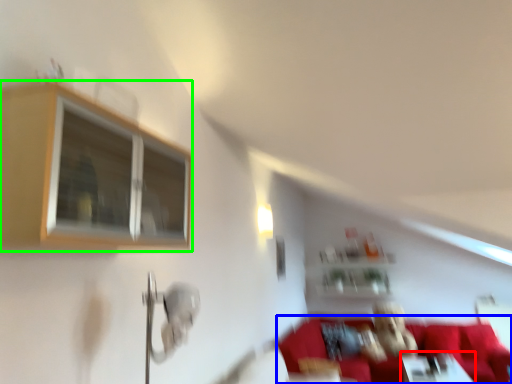
Question: Estimate the real-world distances between objects in this image. Which object is closer to table (highlighted by a red box), couch (highlighted by a blue box) or window (highlighted by a green box)?

Choices:
 (A) couch
 (B) window

Answer: (A)